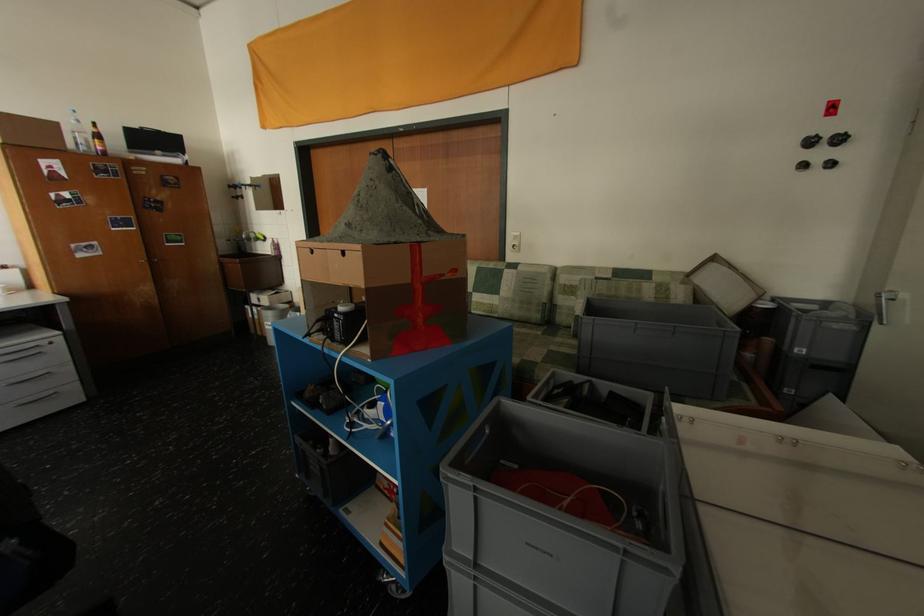
Image resolution: width=924 pixels, height=616 pixels. What do you see at coordinates (43, 403) in the screenshot?
I see `a cardboard drawer handle` at bounding box center [43, 403].